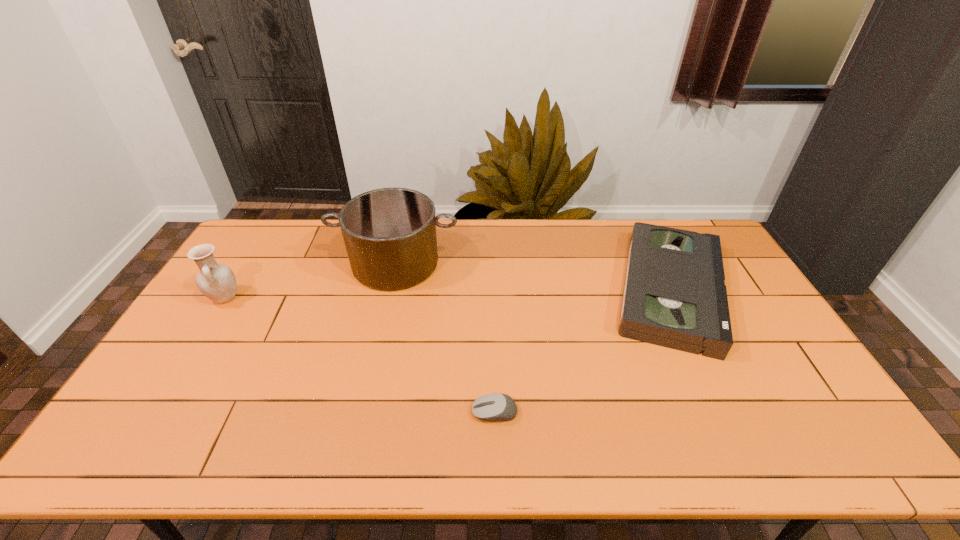
Where is `vacant area that lies between the leftmost object and the pan`? vacant area that lies between the leftmost object and the pan is located at coordinates [x=310, y=281].

The image size is (960, 540). What are the coordinates of `free area in between the rightmost object and the nearest object` in the screenshot? It's located at tap(583, 351).

What are the coordinates of `free spot between the third object from right to left and the videotape` in the screenshot? It's located at (534, 277).

This screenshot has height=540, width=960. I want to click on free spot between the videotape and the pottery, so click(448, 294).

This screenshot has height=540, width=960. Find the location of `free spot between the leftmost object and the second shortest object`. free spot between the leftmost object and the second shortest object is located at coordinates 448,294.

What are the coordinates of `vacant region between the second object from left to right and the rightmost object` in the screenshot? It's located at (534, 277).

The width and height of the screenshot is (960, 540). I want to click on unoccupied position between the third object from left to right and the pottery, so click(x=360, y=355).

In order to click on empty location between the rightmost object and the nearest object in this screenshot , I will do `click(583, 351)`.

At what (x,y) coordinates should I click in order to perform the action: click on vacant space that is in between the pottery and the third object from right to left. Please return your answer as a coordinate pair (x, y). Looking at the image, I should click on (310, 281).

The width and height of the screenshot is (960, 540). What are the coordinates of `vacant area that lies between the videotape and the shortest object` in the screenshot? It's located at (583, 351).